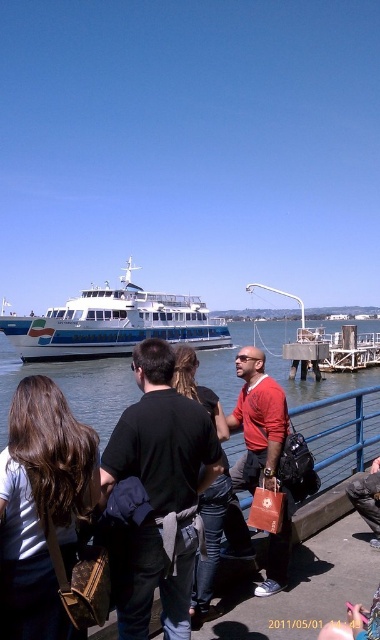
You are a photographer planning to take a photo of the waterfront scene. You want to ensure both the clear blue water at center and the black leather jacket at center are visible in your shot. Based on their widths, which object should you prioritize framing closer to the edge of the photo to avoid overcrowding?

The black leather jacket at center should be prioritized closer to the edge of the photo because its width is narrower than the clear blue water at center, which is wider. This arrangement will help prevent overcrowding in the composition.

You are a photographer trying to capture a photo of the white glossy ferry at center without any obstructions. You notice the matte brown purse at left is blocking your view. Can you estimate if the ferry is taller than the purse?

The white glossy ferry at center is taller than the matte brown purse at left, so the ferry will be visible above the purse in your photo.

You are a photographer standing at the waterfront. You want to capture a photo of the white glossy ferry at center and the black leather jacket at center in the same frame. Which object should you focus on first if you want to ensure both are in focus without moving the camera?

The white glossy ferry at center is wider than the black leather jacket at center. Since the ferry is wider, focusing on it first would help ensure both objects remain in focus as it occupies more of the frame.